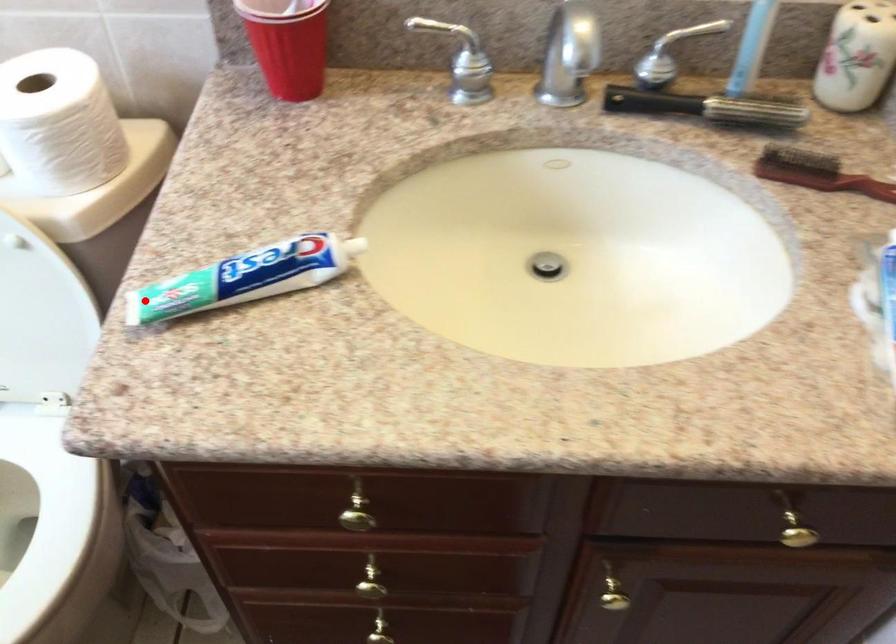
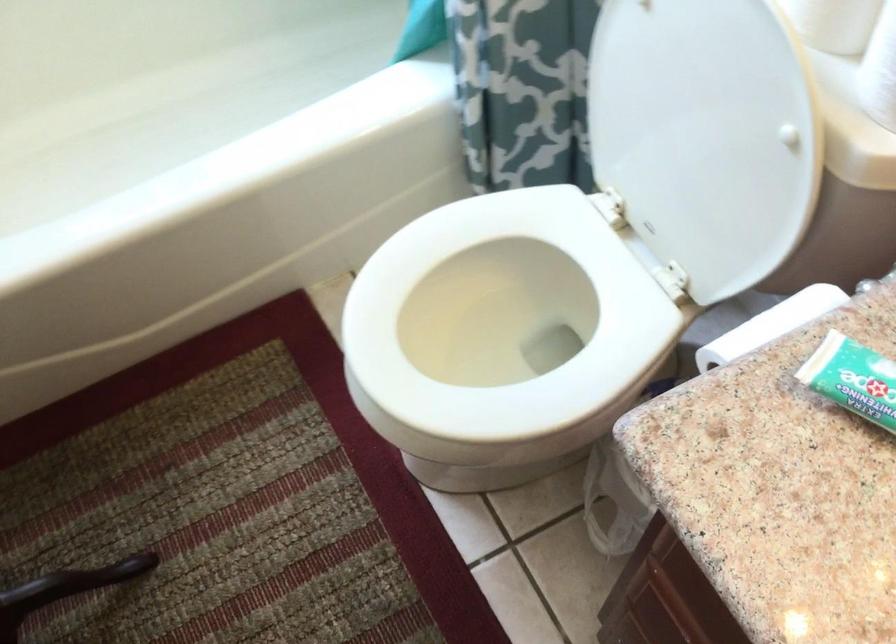
Question: I am providing you with two images of the same scene from different viewpoints. Image1 has a red point marked. In image2, the corresponding 3D location appears at what relative position? Reply with the corresponding letter.

Choices:
 (A) Closer
 (B) Farther

Answer: (A)